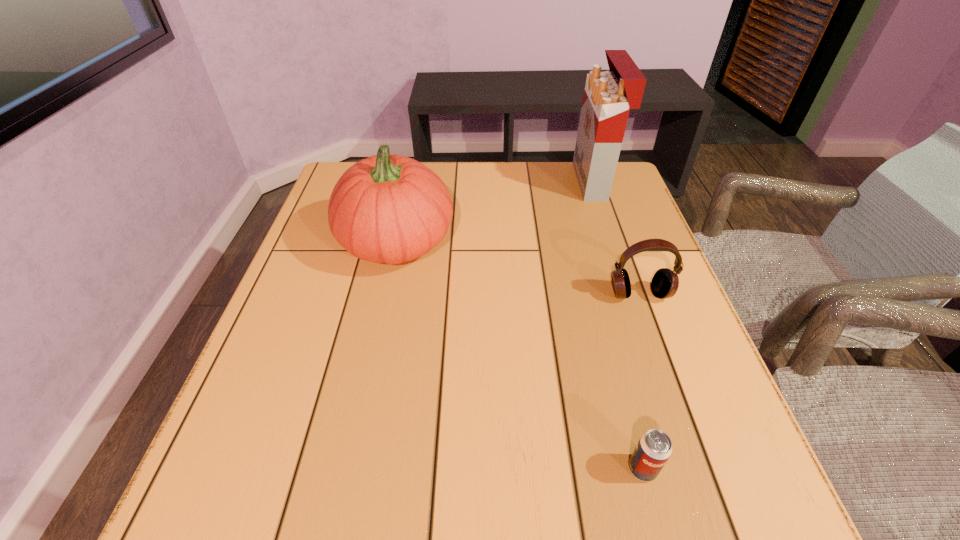
Locate an element on the screen. vacant area that lies between the farthest object and the third tallest object is located at coordinates (616, 238).

Where is `empty space between the tallest object and the leftmost object`? The width and height of the screenshot is (960, 540). empty space between the tallest object and the leftmost object is located at coordinates (494, 211).

This screenshot has height=540, width=960. In order to click on unoccupied area between the beer can and the second farthest object in this screenshot , I will do `click(519, 355)`.

Where is `vacant area that lies between the tallest object and the nearest object`? Image resolution: width=960 pixels, height=540 pixels. vacant area that lies between the tallest object and the nearest object is located at coordinates (618, 325).

At what (x,y) coordinates should I click in order to perform the action: click on blank region between the shortest object and the tallest object. Please return your answer as a coordinate pair (x, y). Looking at the image, I should click on (618, 325).

Locate an element on the screen. This screenshot has width=960, height=540. vacant space in between the farthest object and the headset is located at coordinates (616, 238).

At what (x,y) coordinates should I click in order to perform the action: click on free area in between the headset and the farthest object. Please return your answer as a coordinate pair (x, y). Looking at the image, I should click on (616, 238).

Where is `free point between the tallest object and the second shortest object`? This screenshot has width=960, height=540. free point between the tallest object and the second shortest object is located at coordinates (616, 238).

Where is `object that is the closest to the pumpkin`? object that is the closest to the pumpkin is located at coordinates (665, 282).

Select which object appears as the closest to the second farthest object. Please provide its 2D coordinates. Your answer should be formatted as a tuple, i.e. [(x, y)], where the tuple contains the x and y coordinates of a point satisfying the conditions above.

[(665, 282)]